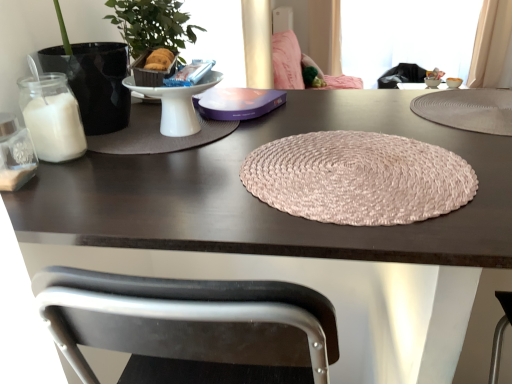
Question: Considering the positions of point (195, 34) and point (426, 23), is point (195, 34) closer or farther from the camera than point (426, 23)?

Choices:
 (A) farther
 (B) closer

Answer: (B)

Question: From a real-world perspective, is green leafy plant at left above or below transparent plastic window screen at upper right?

Choices:
 (A) above
 (B) below

Answer: (A)

Question: Estimate the real-world distances between objects in this image. Which object is closer to the matte black placemat at left, which is the second mat in right-to-left order?

Choices:
 (A) transparent plastic window screen at upper right
 (B) pink woven placemat at center
 (C) beige fabric curtain at upper right
 (D) clear glass candle holder at left
 (E) beige woven mat at upper right, the 2th mat from the left

Answer: (D)

Question: Considering the real-world distances, which object is closest to the matte black placemat at left, which is the second mat in right-to-left order?

Choices:
 (A) beige fabric curtain at upper right
 (B) green leafy plant at left
 (C) pink woven placemat at center
 (D) clear glass candle holder at left
 (E) transparent plastic window screen at upper right

Answer: (B)